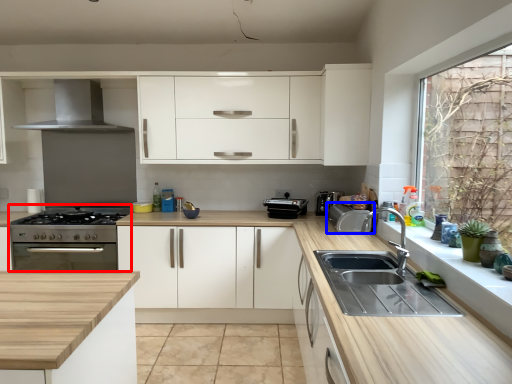
Question: Which object is closer to the camera taking this photo, appliance (highlighted by a red box) or appliance (highlighted by a blue box)?

Choices:
 (A) appliance
 (B) appliance

Answer: (B)